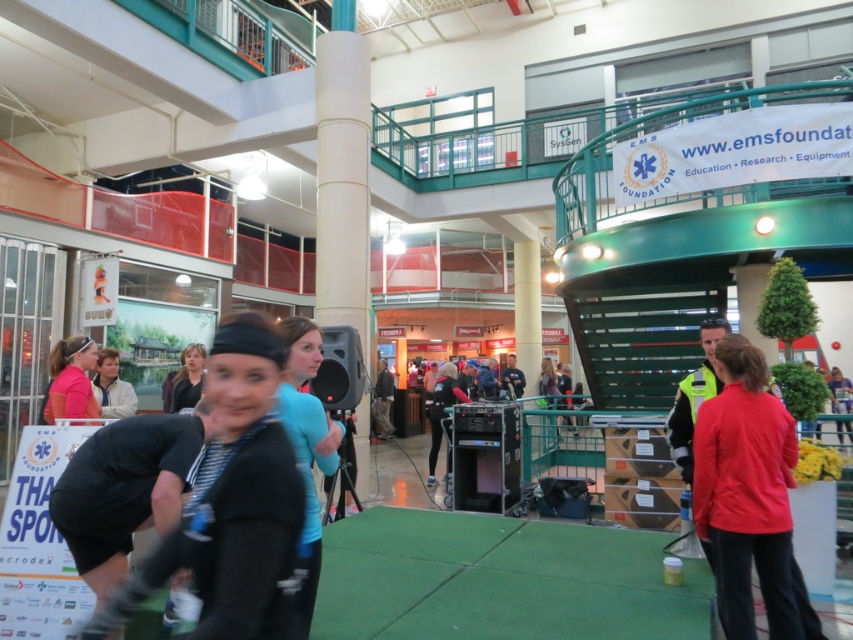
From the picture: You are an event planner standing at the entrance of the event space. You need to place a 10 feet long banner between the red matte jacket at center and the pink fabric headband at upper left. Can you fit the banner between them?

The distance between the red matte jacket at center and the pink fabric headband at upper left is 11.44 feet. Since the banner is 10 feet long, it can fit between them with 1.44 feet of space remaining.

You are organizing a photo shoot and need to ensure that the black matte headband at center and the light blue shirt at center are both visible in the frame. Given that the headband is wider than the shirt, how should you adjust your camera angle to best capture both items without cropping either?

Since the black matte headband at center is wider than the light blue shirt at center, you should position the camera to focus on the headband first, ensuring its full width is captured, then adjust the angle slightly to include the shirt within the same frame. This way, both items remain visible without cropping.

You are organizing a photo shoot in this event space and need to position two props. The black matte headband at center and the light blue shirt at center are already placed. You want to ensure the distance between them is exactly 10 feet for the camera framing. Is the current placement suitable?

The black matte headband at center is 10.72 feet from the light blue shirt at center. Since 10.72 feet is slightly more than 10 feet, the current placement is slightly too far apart for the desired 10 feet distance.